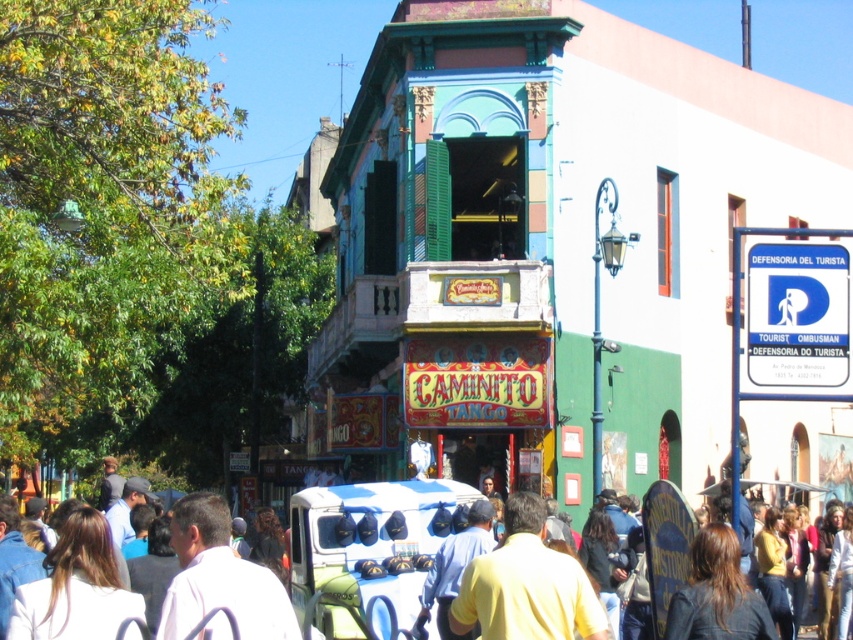
Based on the photo, you are a photographer standing in front of the Caminito Tango building. You want to take a photo of the white fabric backpack at lower left and the white matte shirt at center so that both are clearly visible. Given that your camera has a minimum focus distance of 20 inches, will you be able to capture both objects in focus?

The white fabric backpack at lower left and white matte shirt at center are 20.25 inches apart from each other. Since the minimum focus distance is 20 inches, the 20.25 inches distance is just enough to keep both objects in focus.